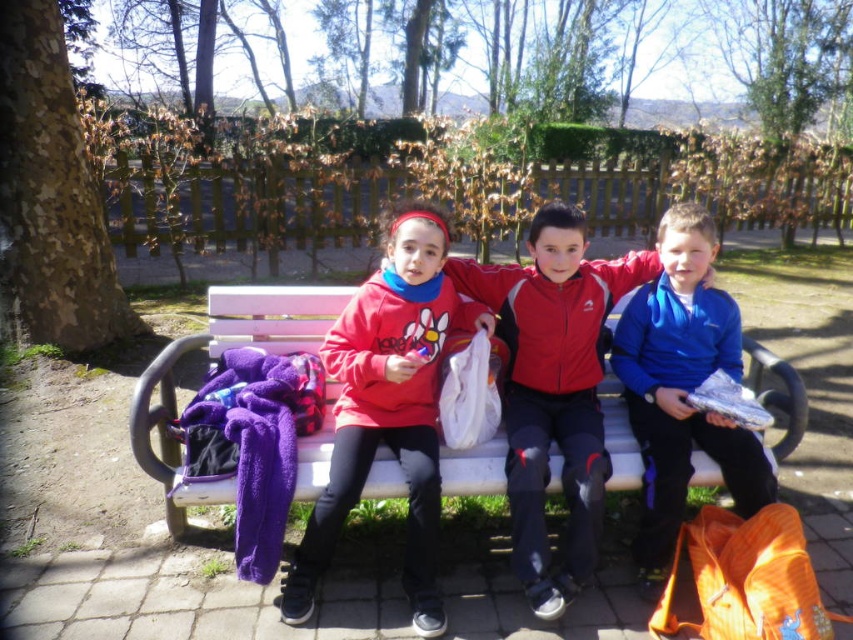
From the picture: You are a photographer standing at the center of the park. You want to take a photo of the red matte jacket at center. Where should you aim your camera to capture it in the frame?

You should aim your camera at the point coordinates of (x=553, y=387) to capture the red matte jacket at center in the frame.

You are a parent trying to hand a juice box to both children. The juice box is 6 inches long. Can you place the juice box horizontally between the matte red hoodie at center and the blue fleece jacket at right without it falling through?

The distance between the matte red hoodie at center and the blue fleece jacket at right is 30.24 inches. Since the juice box is only 6 inches long, it can easily be placed horizontally between them without falling through.

You are a photographer trying to capture a candid shot of the two children on the park bench. You want to ensure the matte red hoodie at center and the blue fleece jacket at right are both in the frame. Based on their positions, which child should you focus on first to capture both in the shot?

The matte red hoodie at center is to the left of the blue fleece jacket at right. To capture both in the frame, focus on the matte red hoodie at center first since it is positioned to the left of the blue fleece jacket at right, ensuring the entire arrangement from left to right is included in the shot.